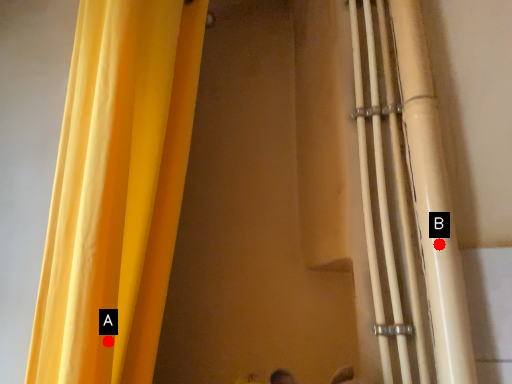
Question: Two points are circled on the image, labeled by A and B beside each circle. Which point is closer to the camera?

Choices:
 (A) A is closer
 (B) B is closer

Answer: (A)